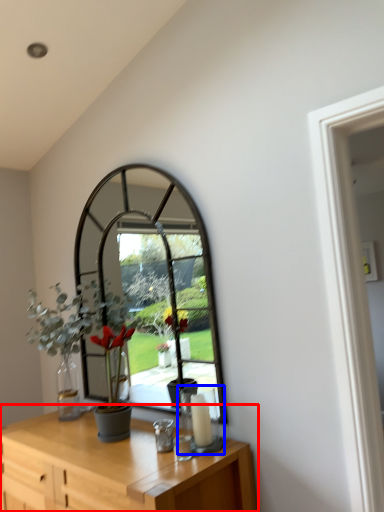
Question: Which point is further to the camera, table (highlighted by a red box) or candle holder (highlighted by a blue box)?

Choices:
 (A) table
 (B) candle holder

Answer: (B)